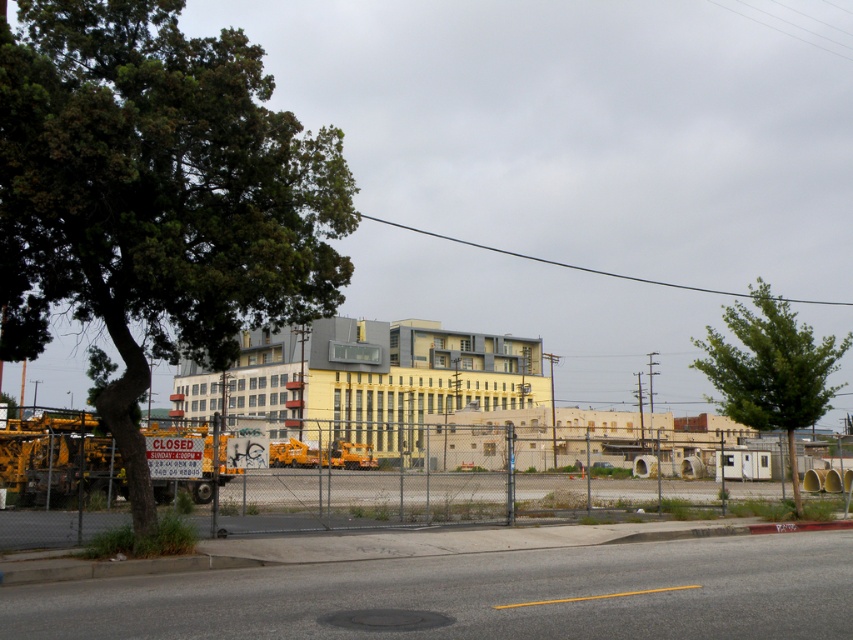
Question: Among these points, which one is farthest from the camera?

Choices:
 (A) (177, 138)
 (B) (300, 464)
 (C) (810, 358)

Answer: (C)

Question: Among these objects, which one is farthest from the camera?

Choices:
 (A) yellow matte school bus at center
 (B) green leafy tree at lower right
 (C) green leafy tree at left

Answer: (B)

Question: Which point is closer to the camera?

Choices:
 (A) green leafy tree at left
 (B) yellow matte school bus at center

Answer: (A)

Question: Is green leafy tree at lower right below yellow matte school bus at center?

Choices:
 (A) no
 (B) yes

Answer: (A)

Question: Does green leafy tree at lower right have a smaller size compared to yellow matte school bus at center?

Choices:
 (A) no
 (B) yes

Answer: (A)

Question: Does green leafy tree at left appear under green leafy tree at lower right?

Choices:
 (A) no
 (B) yes

Answer: (A)